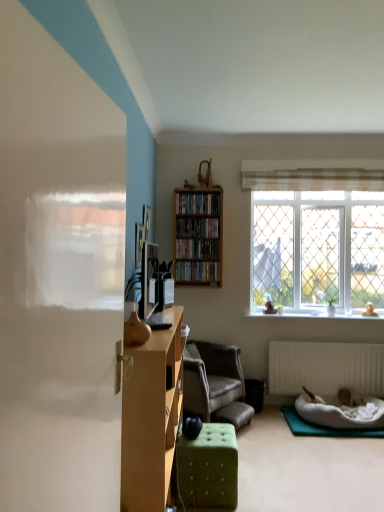
Question: Is white plush pet bed at lower right further to the viewer compared to wooden shelf at center, arranged as the first book when viewed from the top?

Choices:
 (A) yes
 (B) no

Answer: (B)

Question: From a real-world perspective, is white plush pet bed at lower right beneath wooden shelf at center, arranged as the first book when viewed from the top?

Choices:
 (A) yes
 (B) no

Answer: (A)

Question: Is white plush pet bed at lower right wider than wooden shelf at center, arranged as the first book when viewed from the top?

Choices:
 (A) no
 (B) yes

Answer: (B)

Question: Is white plush pet bed at lower right aimed at wooden shelf at center, the fourth book positioned from the bottom?

Choices:
 (A) yes
 (B) no

Answer: (B)

Question: From the image's perspective, is white plush pet bed at lower right located above wooden shelf at center, arranged as the first book when viewed from the top?

Choices:
 (A) yes
 (B) no

Answer: (B)

Question: Is the position of white plush pet bed at lower right less distant than that of wooden shelf at center, the fourth book positioned from the bottom?

Choices:
 (A) no
 (B) yes

Answer: (B)

Question: Can you confirm if wooden bookshelf at center, which is counted as the third book, starting from the top, is positioned to the right of white plastic radiator at lower right?

Choices:
 (A) no
 (B) yes

Answer: (A)

Question: Is wooden bookshelf at center, which is counted as the 2th book, starting from the bottom, smaller than white plastic radiator at lower right?

Choices:
 (A) yes
 (B) no

Answer: (A)

Question: From the image's perspective, is wooden bookshelf at center, which is counted as the third book, starting from the top, located beneath white plastic radiator at lower right?

Choices:
 (A) yes
 (B) no

Answer: (B)

Question: Can you confirm if wooden bookshelf at center, which is counted as the third book, starting from the top, is wider than white plastic radiator at lower right?

Choices:
 (A) no
 (B) yes

Answer: (B)

Question: Can you confirm if wooden bookshelf at center, which is counted as the third book, starting from the top, is positioned to the left of white plastic radiator at lower right?

Choices:
 (A) no
 (B) yes

Answer: (B)

Question: From the image's perspective, is wooden bookshelf at center, which is counted as the third book, starting from the top, above white plastic radiator at lower right?

Choices:
 (A) yes
 (B) no

Answer: (A)

Question: Is the depth of clear glass window at upper right less than that of matte brown vase at center?

Choices:
 (A) yes
 (B) no

Answer: (B)